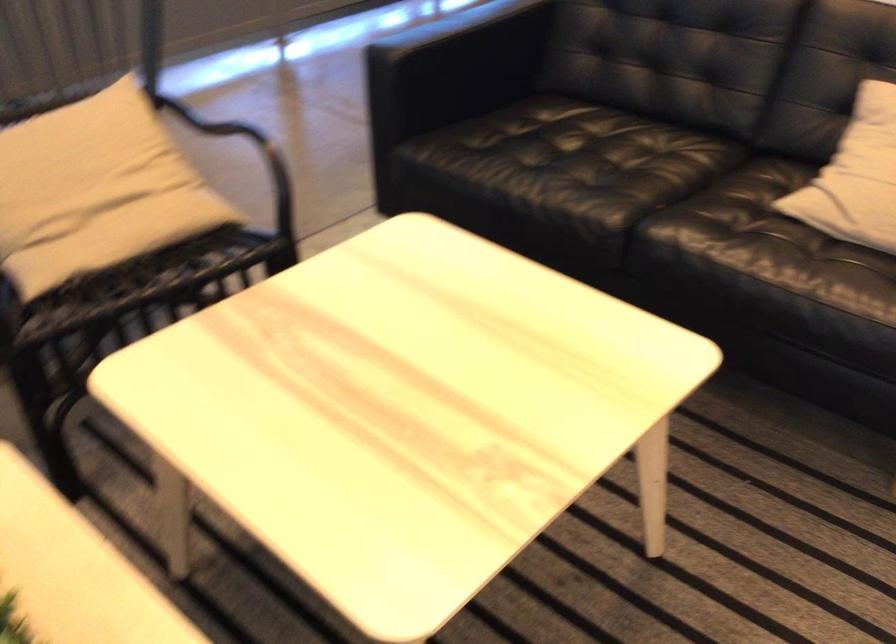
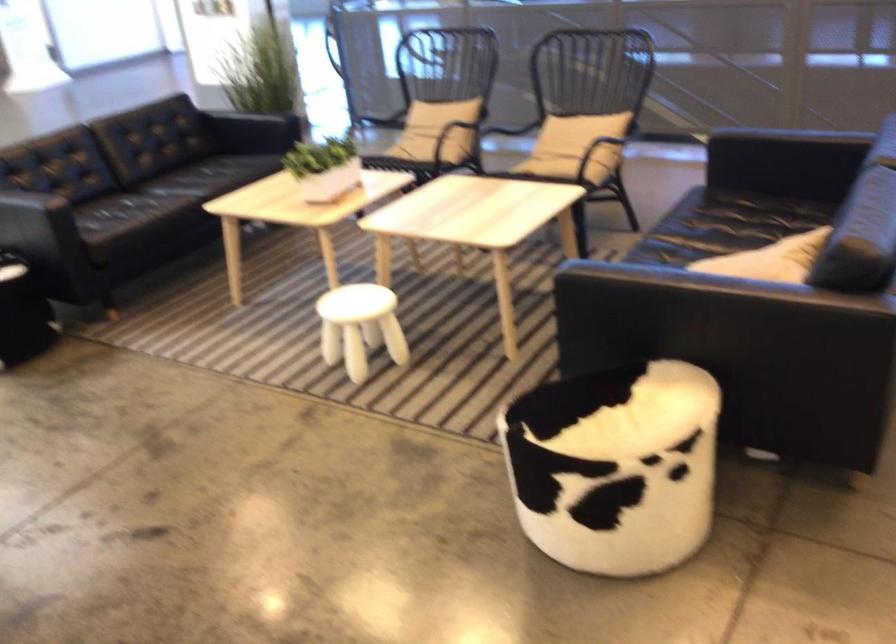
Locate, in the second image, the point that corresponds to pixel 186 182 in the first image.

(574, 147)